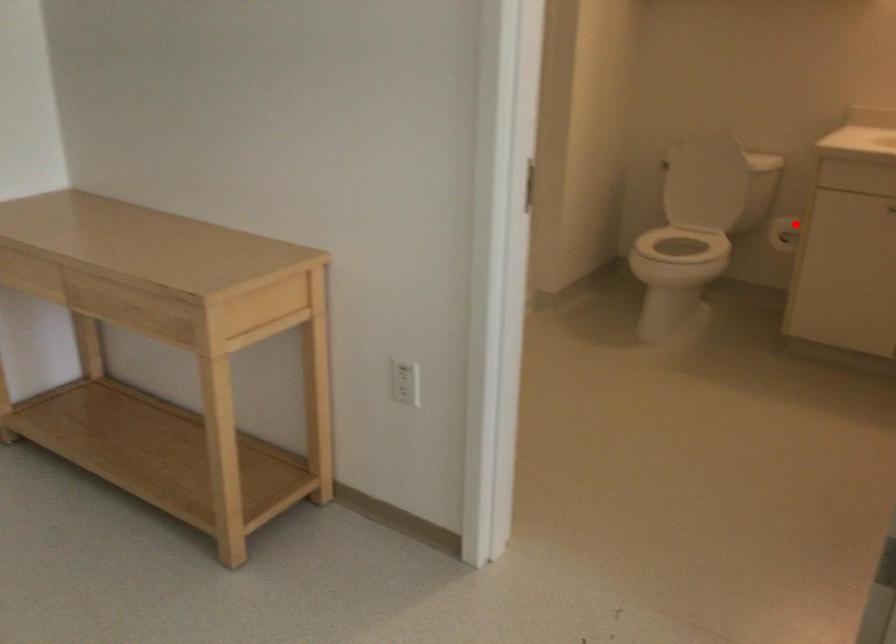
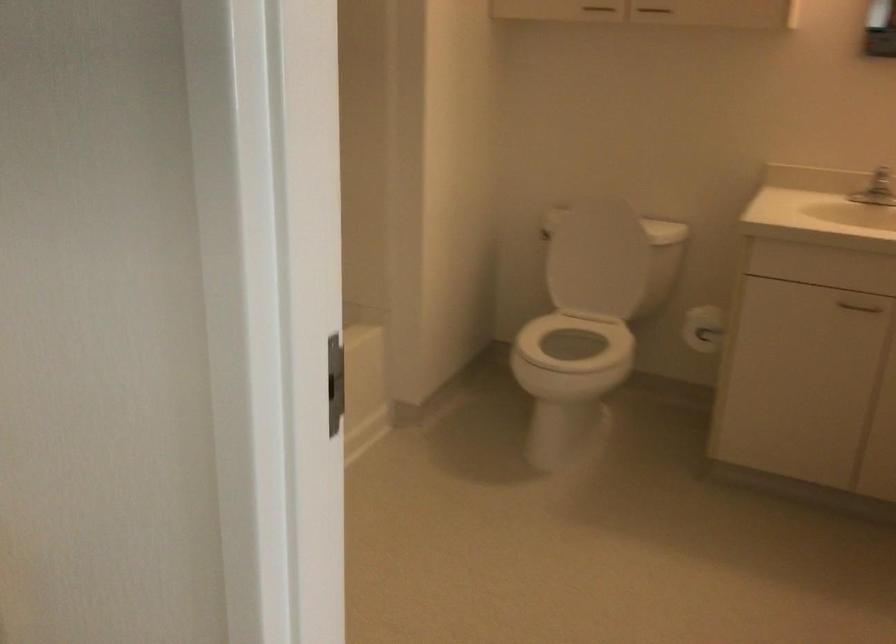
Question: I am providing you with two images of the same scene from different viewpoints. Image1 has a red point marked. In image2, the corresponding 3D location appears at what relative position? Reply with the corresponding letter.

Choices:
 (A) Closer
 (B) Farther

Answer: (A)